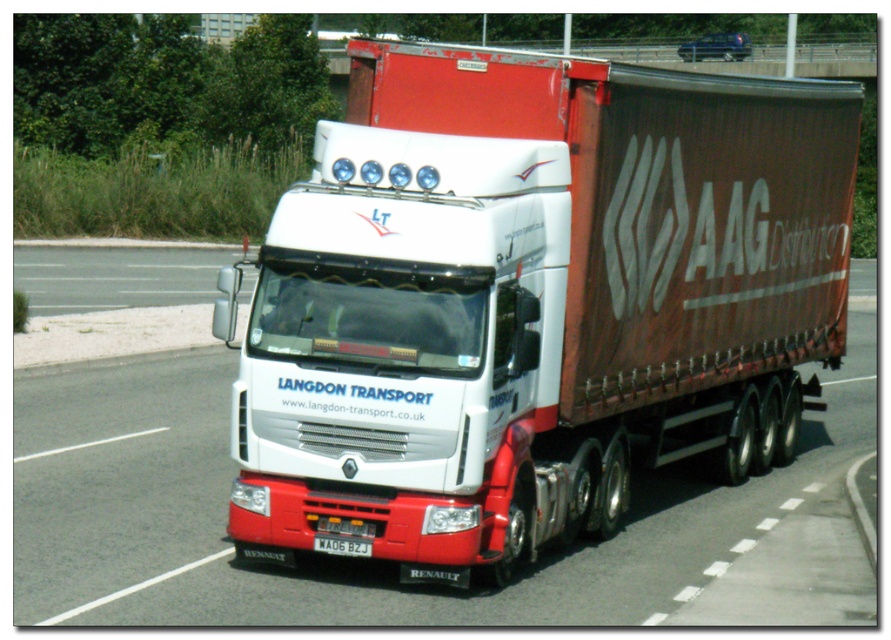
Is white matte truck at center positioned in front of white glossy truck at center?

No, white matte truck at center is further to the viewer.

Between white matte truck at center and white glossy truck at center, which one has less height?

With less height is white matte truck at center.

Which is in front, point (804, 285) or point (248, 596)?

Point (248, 596) is more forward.

You are a GUI agent. You are given a task and a screenshot of the screen. Output one action in this format:
    pyautogui.click(x=<x>, y=<y>)
    Task: Click on the white matte truck at center
    
    Given the screenshot: What is the action you would take?
    pyautogui.click(x=532, y=300)

Who is lower down, white matte truck at center or red plastic license plate at bottom center?

Positioned lower is red plastic license plate at bottom center.

Where is `white matte truck at center`? white matte truck at center is located at coordinates (532, 300).

In the scene shown: Who is higher up, white glossy truck at center or red plastic license plate at bottom center?

white glossy truck at center is above.

Does white glossy truck at center appear on the left side of red plastic license plate at bottom center?

No, white glossy truck at center is not to the left of red plastic license plate at bottom center.

Which is in front, point (187, 355) or point (341, 547)?

Point (341, 547)

Identify the location of white glossy truck at center. (329, 557).